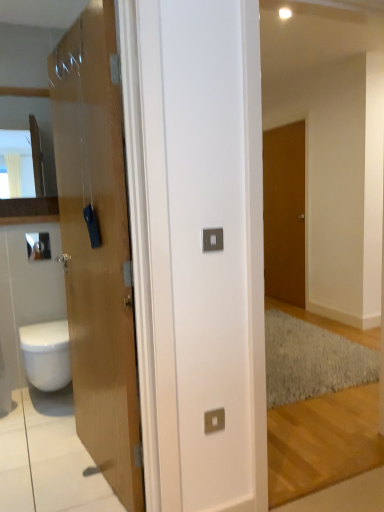
The image size is (384, 512). I want to click on matte wooden door at left, which is the 1th door in left-to-right order, so click(98, 247).

Describe the element at coordinates (284, 213) in the screenshot. I see `brown matte door at center-right, which is the 1th door in right-to-left order` at that location.

Identify the location of matte wood cabinet at left. This screenshot has height=512, width=384. (27, 155).

Can you tell me how much white glossy bidet at lower left and metallic square at center, the second electric outlet from the front, differ in facing direction?

white glossy bidet at lower left and metallic square at center, the second electric outlet from the front, are facing 0.0191 degrees away from each other.

Is white glossy bidet at lower left positioned behind metallic square at center, arranged as the first electric outlet when ordered from the bottom?

Yes, the depth of white glossy bidet at lower left is greater than that of metallic square at center, arranged as the first electric outlet when ordered from the bottom.

Who is smaller, white glossy bidet at lower left or metallic square at center, arranged as the first electric outlet when ordered from the bottom?

Smaller between the two is metallic square at center, arranged as the first electric outlet when ordered from the bottom.

The image size is (384, 512). Find the location of `bidet that is below the metallic square at center, arranged as the first electric outlet when ordered from the bottom (from the image's perspective)`. bidet that is below the metallic square at center, arranged as the first electric outlet when ordered from the bottom (from the image's perspective) is located at coordinates (46, 354).

From the picture: Considering the sizes of objects brown matte door at center-right, which is the 1th door in right-to-left order, and white glossy bidet at lower left in the image provided, who is thinner, brown matte door at center-right, which is the 1th door in right-to-left order, or white glossy bidet at lower left?

With smaller width is brown matte door at center-right, which is the 1th door in right-to-left order.

Is brown matte door at center-right, which is the 2th door from front to back, inside or outside of white glossy bidet at lower left?

brown matte door at center-right, which is the 2th door from front to back, is not enclosed by white glossy bidet at lower left.

Is point (301, 207) positioned before point (29, 376)?

No, it is not.

Is brown matte door at center-right, which is the 1th door in right-to-left order, not close to white glossy bidet at lower left?

Yes, brown matte door at center-right, which is the 1th door in right-to-left order, and white glossy bidet at lower left are located far from each other.

Is brown matte door at center-right, which is the 1th door in right-to-left order, positioned behind matte wood cabinet at left?

Yes, brown matte door at center-right, which is the 1th door in right-to-left order, is behind matte wood cabinet at left.

From the image's perspective, is brown matte door at center-right, which is the 2th door from front to back, over matte wood cabinet at left?

No, from the image's perspective, brown matte door at center-right, which is the 2th door from front to back, is not on top of matte wood cabinet at left.

Considering the relative sizes of brown matte door at center-right, which is the 1th door in right-to-left order, and matte wood cabinet at left in the image provided, is brown matte door at center-right, which is the 1th door in right-to-left order, shorter than matte wood cabinet at left?

In fact, brown matte door at center-right, which is the 1th door in right-to-left order, may be taller than matte wood cabinet at left.

From a real-world perspective, which is physically below, brown matte door at center-right, positioned as the second door in left-to-right order, or matte wood cabinet at left?

In real-world perspective, brown matte door at center-right, positioned as the second door in left-to-right order, is lower.

Considering the sizes of objects metallic square at center, which is the first electric outlet in back-to-front order, and brown matte door at center-right, which is the 1th door in right-to-left order, in the image provided, who is shorter, metallic square at center, which is the first electric outlet in back-to-front order, or brown matte door at center-right, which is the 1th door in right-to-left order,?

metallic square at center, which is the first electric outlet in back-to-front order, is shorter.

From a real-world perspective, which object rests below the other?

metallic square at center, the second electric outlet from the front, is physically lower.

Are metallic square at center, the second electric outlet from the front, and brown matte door at center-right, which is the 1th door in right-to-left order, located far from each other?

metallic square at center, the second electric outlet from the front, is far away from brown matte door at center-right, which is the 1th door in right-to-left order.

Which object is closer to the camera taking this photo, metallic square at center, the 2th electric outlet in the top-to-bottom sequence, or brown matte door at center-right, positioned as the second door in left-to-right order?

metallic square at center, the 2th electric outlet in the top-to-bottom sequence, is more forward.

Is matte wooden door at left, which is the second door in right-to-left order, to the left or to the right of metallic square at center, which is the first electric outlet in back-to-front order, in the image?

From the image, it's evident that matte wooden door at left, which is the second door in right-to-left order, is to the left of metallic square at center, which is the first electric outlet in back-to-front order.

The image size is (384, 512). In order to click on the 1st door located above the metallic square at center, which is the first electric outlet in back-to-front order (from a real-world perspective) in this screenshot , I will do `click(98, 247)`.

Who is shorter, matte wooden door at left, placed as the second door when sorted from back to front, or metallic square at center, arranged as the first electric outlet when ordered from the bottom?

metallic square at center, arranged as the first electric outlet when ordered from the bottom, is shorter.

Considering the sizes of objects white glossy bidet at lower left and matte wood cabinet at left in the image provided, who is shorter, white glossy bidet at lower left or matte wood cabinet at left?

With less height is white glossy bidet at lower left.

Is white glossy bidet at lower left in front of matte wood cabinet at left?

Yes, it is in front of matte wood cabinet at left.

Which of these two, white glossy bidet at lower left or matte wood cabinet at left, is smaller?

Smaller between the two is matte wood cabinet at left.

From a real-world perspective, who is located lower, white glossy bidet at lower left or matte wood cabinet at left?

white glossy bidet at lower left, from a real-world perspective.

Between matte wood cabinet at left and satin silver switch at center, which is counted as the 1th electric outlet, starting from the top, which one has larger width?

matte wood cabinet at left is wider.

Can you tell me how much matte wood cabinet at left and satin silver switch at center, acting as the 1th electric outlet starting from the front, differ in facing direction?

There is a 0.0111-degree angle between the facing directions of matte wood cabinet at left and satin silver switch at center, acting as the 1th electric outlet starting from the front.

Which is more to the left, matte wood cabinet at left or satin silver switch at center, which is counted as the 1th electric outlet, starting from the top?

matte wood cabinet at left is more to the left.

From the image's perspective, relative to satin silver switch at center, which is the second electric outlet from back to front, is matte wood cabinet at left above or below?

Clearly, from the image's perspective, matte wood cabinet at left is above satin silver switch at center, which is the second electric outlet from back to front.

From the white glossy bidet at lower left, count 1st electric outlets forward and point to it. Please provide its 2D coordinates.

[(214, 420)]

Starting from the white glossy bidet at lower left, which door is the 2nd one to the right? Please provide its 2D coordinates.

[(284, 213)]

When comparing their distances from metallic square at center, the second electric outlet from the front, does matte wood cabinet at left or white glossy bidet at lower left seem closer?

The object closer to metallic square at center, the second electric outlet from the front, is white glossy bidet at lower left.

From the image, which object appears to be nearer to brown matte door at center-right, which is the 2th door from front to back, metallic square at center, which is the first electric outlet in back-to-front order, or satin silver switch at center, which is counted as the 1th electric outlet, starting from the top?

satin silver switch at center, which is counted as the 1th electric outlet, starting from the top, is positioned closer to the anchor brown matte door at center-right, which is the 2th door from front to back.

Considering their positions, is white glossy bidet at lower left positioned further to brown matte door at center-right, which is the 1th door in right-to-left order, than satin silver switch at center, acting as the 1th electric outlet starting from the front?

Among the two, satin silver switch at center, acting as the 1th electric outlet starting from the front, is located further to brown matte door at center-right, which is the 1th door in right-to-left order.

Based on their spatial positions, is white glossy bidet at lower left or metallic square at center, arranged as the first electric outlet when ordered from the bottom, closer to matte wood cabinet at left?

white glossy bidet at lower left lies closer to matte wood cabinet at left than the other object.

Based on their spatial positions, is white glossy bidet at lower left or satin silver switch at center, the 2th electric outlet in the bottom-to-top sequence, further from matte wood cabinet at left?

satin silver switch at center, the 2th electric outlet in the bottom-to-top sequence, lies further to matte wood cabinet at left than the other object.

Based on the photo, which object lies nearer to the anchor point brown matte door at center-right, which is the 2th door from front to back, metallic square at center, arranged as the first electric outlet when ordered from the bottom, or matte wood cabinet at left?

Among the two, matte wood cabinet at left is located nearer to brown matte door at center-right, which is the 2th door from front to back.

Which object lies further to the anchor point matte wood cabinet at left, satin silver switch at center, which is counted as the 1th electric outlet, starting from the top, or matte wooden door at left, placed as the second door when sorted from back to front?

satin silver switch at center, which is counted as the 1th electric outlet, starting from the top, is further to matte wood cabinet at left.

Which object lies nearer to the anchor point satin silver switch at center, which is the second electric outlet from back to front, metallic square at center, the second electric outlet from the front, or matte wooden door at left, which is the second door in right-to-left order?

metallic square at center, the second electric outlet from the front, is closer to satin silver switch at center, which is the second electric outlet from back to front.

The image size is (384, 512). I want to click on bidet between matte wooden door at left, which is the 1th door in left-to-right order, and brown matte door at center-right, the first door positioned from the back, from front to back, so click(x=46, y=354).

Find the location of a particular element. door that lies between satin silver switch at center, which is counted as the 1th electric outlet, starting from the top, and metallic square at center, arranged as the first electric outlet when ordered from the bottom, from top to bottom is located at coordinates (98, 247).

The image size is (384, 512). I want to click on bidet located between matte wood cabinet at left and brown matte door at center-right, which is the 1th door in right-to-left order, in the left-right direction, so click(46, 354).

Locate an element on the screen. Image resolution: width=384 pixels, height=512 pixels. bidet located between metallic square at center, which is the first electric outlet in back-to-front order, and brown matte door at center-right, which is the 1th door in right-to-left order, in the depth direction is located at coordinates (46, 354).